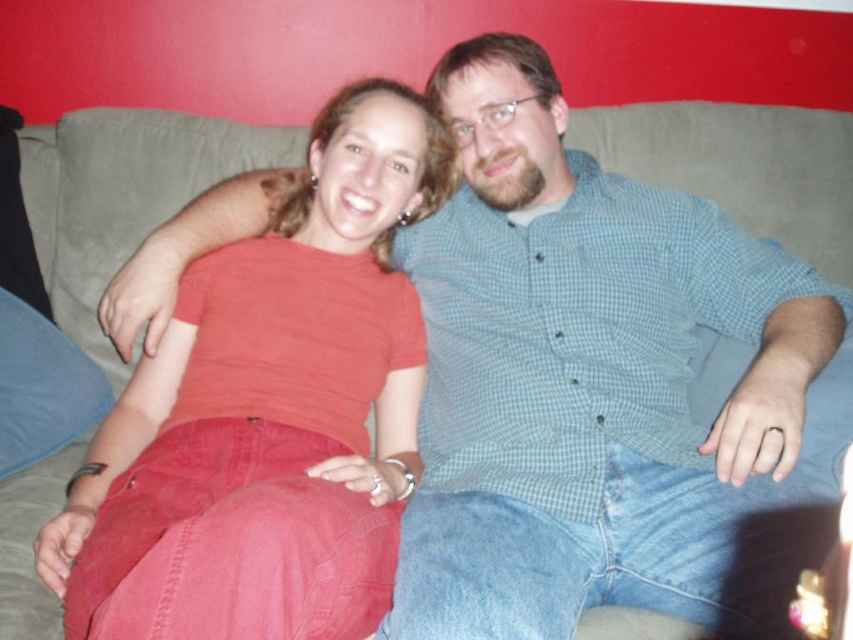
You are a photographer adjusting the lighting for a photo shoot. You notice two shirts in the center of the image, a green checkered shirt at center and a matte red shirt at center. Which shirt is positioned higher in the frame?

The green checkered shirt at center is above the matte red shirt at center, so it is positioned higher in the frame.

You are a photographer setting up a shoot in the living room. You notice two shirts hanging on the couch in the center. The green checkered shirt at center and the matte red shirt at center. Which shirt should you choose to place on the model if you want the shirt to cover more of the model from head to toe?

The green checkered shirt at center is taller than the matte red shirt at center, so it would cover more of the model from head to toe.

Based on the photo, you are a photographer adjusting your camera to focus on both the green checkered shirt at center and the matte red shirt at center. Which shirt should you focus on first to ensure both are in sharp focus?

You should focus on the green checkered shirt at center first because it is closer to you than the matte red shirt at center, ensuring both are in focus when adjusting the camera.